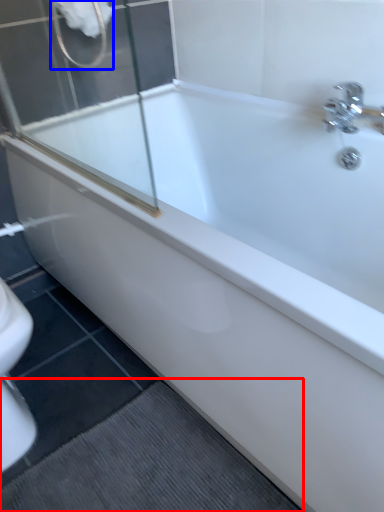
Question: Which object is closer to the camera taking this photo, bath mat (highlighted by a red box) or shower (highlighted by a blue box)?

Choices:
 (A) bath mat
 (B) shower

Answer: (A)